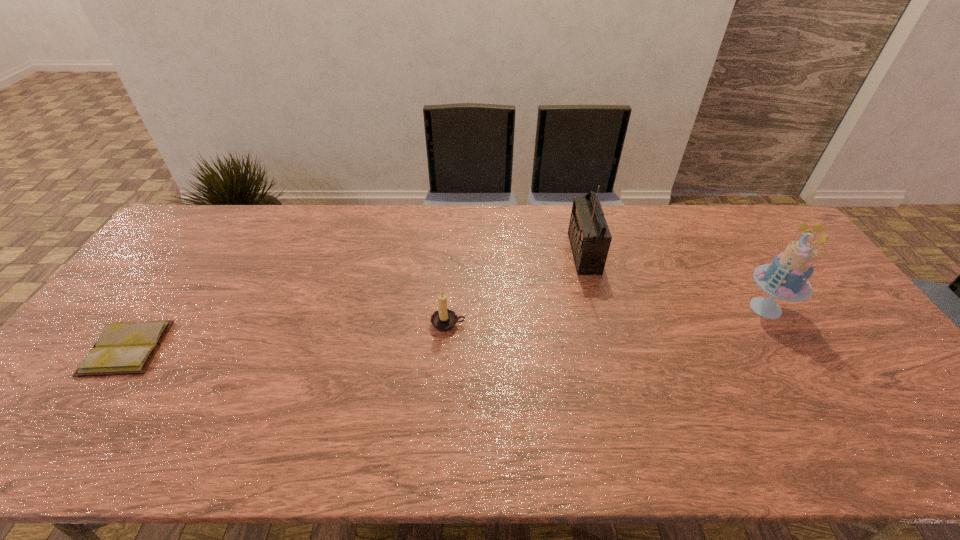
Identify the location of the third closest object relative to the second object from left to right. Image resolution: width=960 pixels, height=540 pixels. (786, 277).

Select which object is the third closest to the farthest object. Please provide its 2D coordinates. Your answer should be formatted as a tuple, i.e. [(x, y)], where the tuple contains the x and y coordinates of a point satisfying the conditions above.

[(122, 348)]

I want to click on vacant space that satisfies the following two spatial constraints: 1. with a ladder on the side of the cake; 2. on the wick of the third tallest object, so click(x=776, y=324).

The width and height of the screenshot is (960, 540). What are the coordinates of `free space that satisfies the following two spatial constraints: 1. with a ladder on the side of the cake; 2. on the wick of the second shortest object` in the screenshot? It's located at (776, 324).

Locate an element on the screen. This screenshot has width=960, height=540. vacant space that satisfies the following two spatial constraints: 1. on the front panel of the second object from right to left; 2. on the wick of the third tallest object is located at coordinates (602, 324).